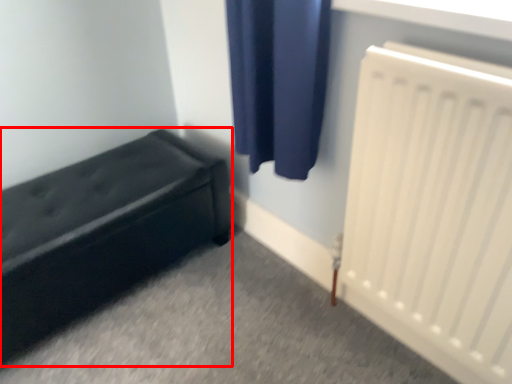
Question: From the image, what is the correct spatial relationship of furniture (annotated by the red box) in relation to radiator?

Choices:
 (A) right
 (B) left

Answer: (B)